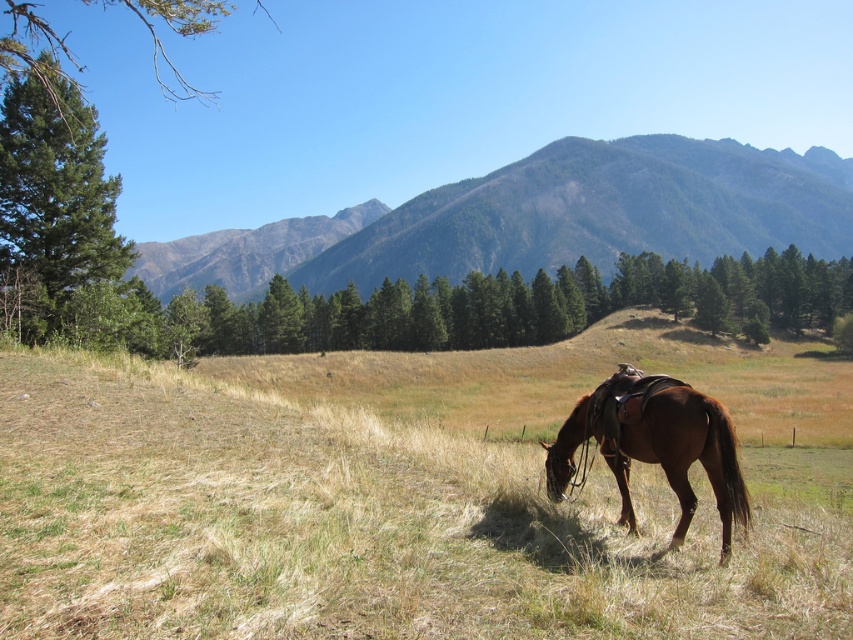
Can you confirm if green forested mountain at upper center is positioned to the left of brown glossy horse at lower center?

Incorrect, green forested mountain at upper center is not on the left side of brown glossy horse at lower center.

Which is below, green forested mountain at upper center or brown glossy horse at lower center?

Positioned lower is brown glossy horse at lower center.

Which is in front, point (775, 216) or point (711, 400)?

Point (711, 400)

Where is `green forested mountain at upper center`? green forested mountain at upper center is located at coordinates (540, 218).

Is green forested mountain at upper center bigger than green textured pine tree at upper left?

Correct, green forested mountain at upper center is larger in size than green textured pine tree at upper left.

This screenshot has width=853, height=640. What do you see at coordinates (540, 218) in the screenshot?
I see `green forested mountain at upper center` at bounding box center [540, 218].

Which is in front, point (808, 216) or point (94, 273)?

Point (94, 273) is more forward.

This screenshot has width=853, height=640. Find the location of `green forested mountain at upper center`. green forested mountain at upper center is located at coordinates (540, 218).

Does green textured pine tree at upper left appear over brown glossy horse at lower center?

Correct, green textured pine tree at upper left is located above brown glossy horse at lower center.

Is point (84, 192) farther from camera compared to point (654, 396)?

Yes, it is behind point (654, 396).

Measure the distance between point (x=20, y=205) and camera.

A distance of 105.55 feet exists between point (x=20, y=205) and camera.

Image resolution: width=853 pixels, height=640 pixels. I want to click on green textured pine tree at upper left, so click(51, 208).